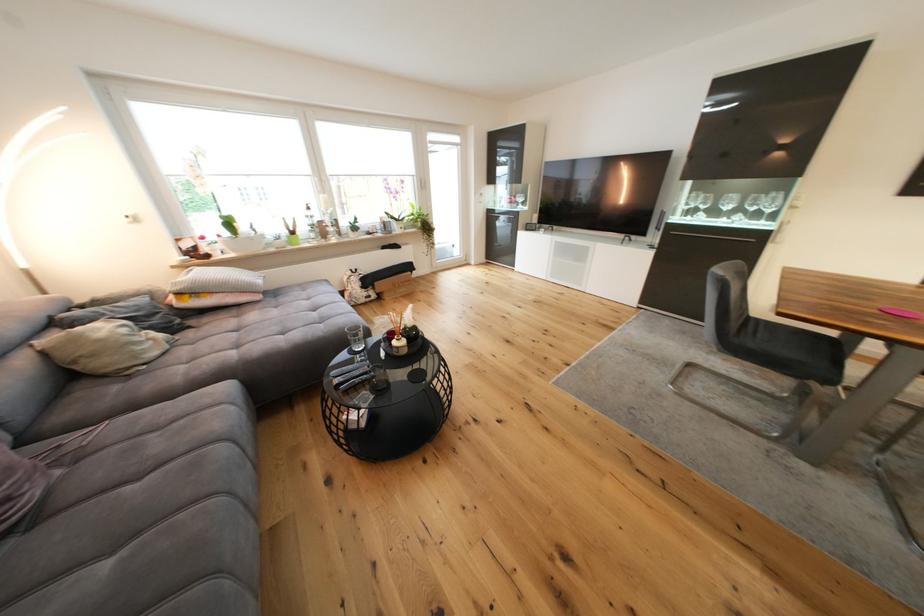
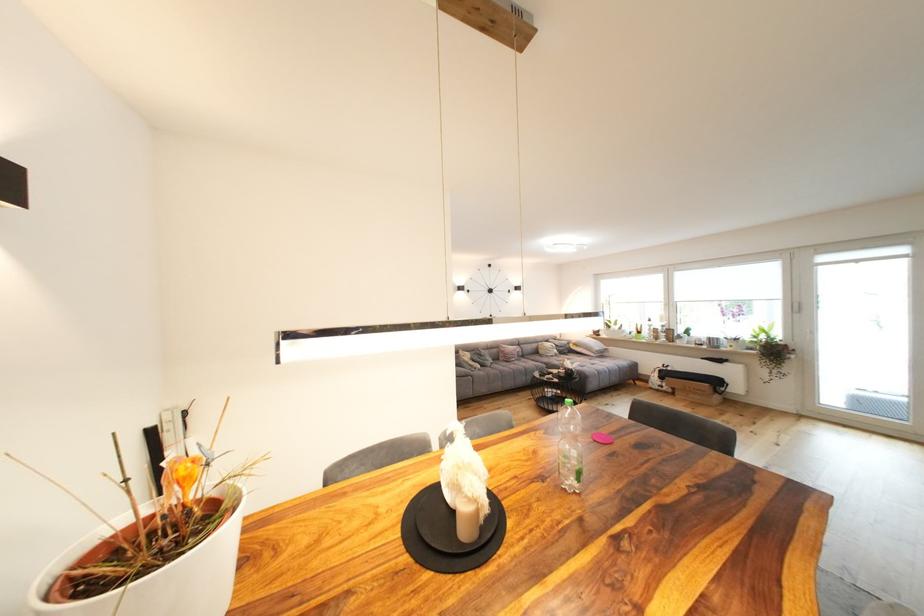
The point at (161, 336) is marked in the first image. Where is the corresponding point in the second image?

(563, 353)